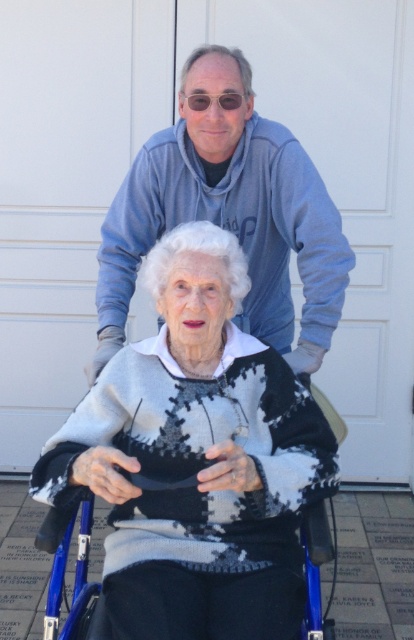
Question: Can you confirm if knitted sweater at center is positioned above matte blue hoodie at upper center?

Choices:
 (A) no
 (B) yes

Answer: (A)

Question: Considering the real-world distances, which object is farthest from the blue plastic wheelchair at center?

Choices:
 (A) matte blue hoodie at upper center
 (B) knitted sweater at center

Answer: (A)

Question: Which object is positioned farthest from the matte blue hoodie at upper center?

Choices:
 (A) knitted sweater at center
 (B) blue plastic wheelchair at center

Answer: (B)

Question: Which point appears farthest from the camera in this image?

Choices:
 (A) (319, 394)
 (B) (315, 266)

Answer: (A)

Question: Is matte blue hoodie at upper center bigger than blue plastic wheelchair at center?

Choices:
 (A) yes
 (B) no

Answer: (A)

Question: Does matte blue hoodie at upper center appear under blue plastic wheelchair at center?

Choices:
 (A) no
 (B) yes

Answer: (A)